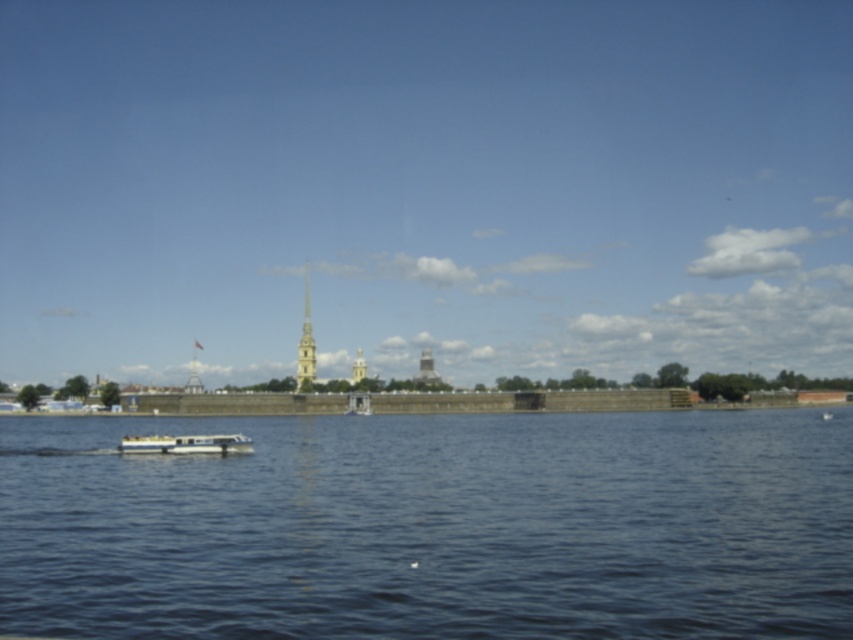
Question: Which of the following is the farthest from the observer?

Choices:
 (A) white glossy boat at lower left
 (B) blue water at center
 (C) smooth gold spire at center

Answer: (C)

Question: Can you confirm if blue water at center is positioned to the right of white glossy boat at lower left?

Choices:
 (A) no
 (B) yes

Answer: (B)

Question: Which object is positioned farthest from the white glossy boat at lower left?

Choices:
 (A) smooth gold spire at center
 (B) blue water at center

Answer: (A)

Question: Where is blue water at center located in relation to smooth gold spire at center in the image?

Choices:
 (A) above
 (B) below

Answer: (B)

Question: Which of the following is the closest to the observer?

Choices:
 (A) (125, 442)
 (B) (300, 369)
 (C) (120, 600)

Answer: (C)

Question: Considering the relative positions of blue water at center and white glossy boat at lower left in the image provided, where is blue water at center located with respect to white glossy boat at lower left?

Choices:
 (A) above
 (B) below

Answer: (B)